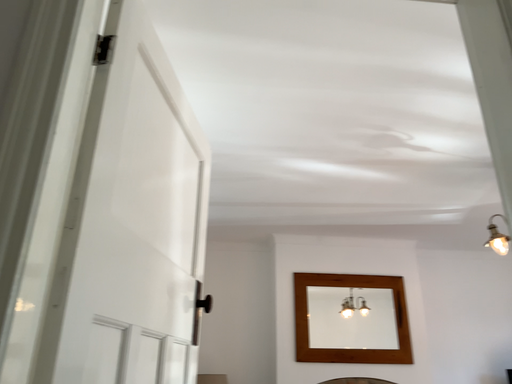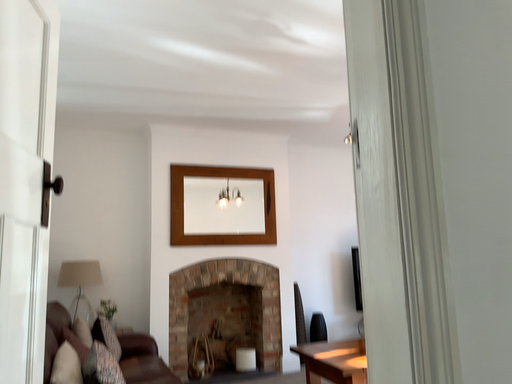
Question: How did the camera likely rotate when shooting the video?

Choices:
 (A) rotated right
 (B) rotated left

Answer: (A)